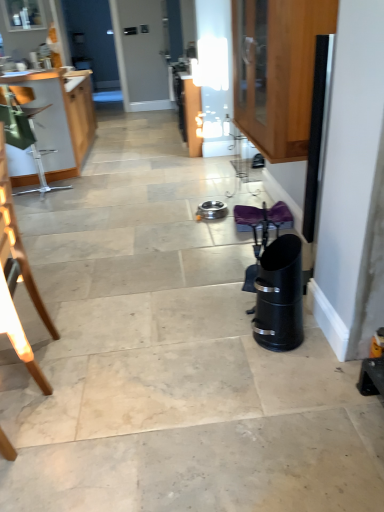
I want to click on free space to the back side of wooden chair at left, so click(x=67, y=322).